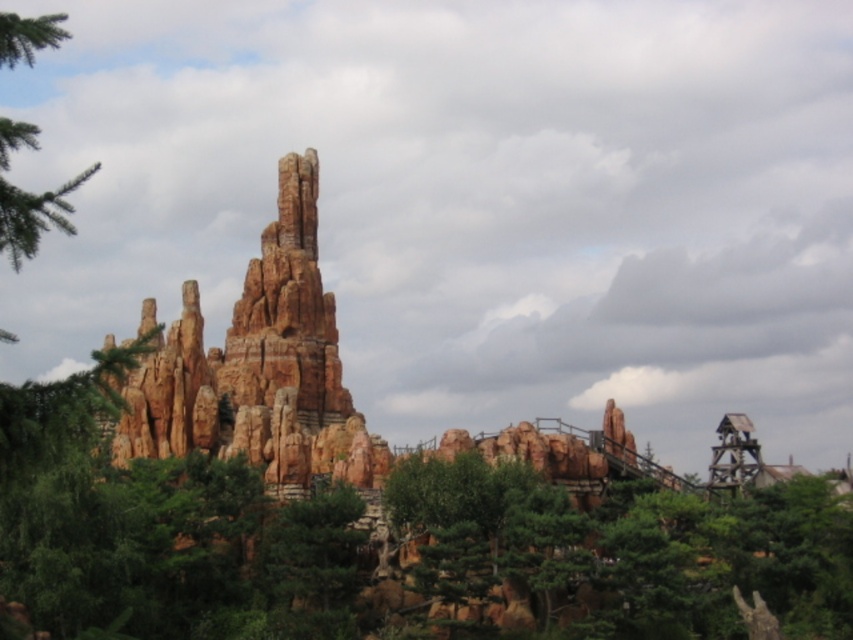
Question: Can you confirm if rustic stone rock formation at center is thinner than green textured tree at upper left?

Choices:
 (A) no
 (B) yes

Answer: (B)

Question: Which point is closer to the camera taking this photo?

Choices:
 (A) (236, 433)
 (B) (15, 212)

Answer: (B)

Question: Among these points, which one is nearest to the camera?

Choices:
 (A) (22, 129)
 (B) (286, 406)

Answer: (A)

Question: Does rustic stone rock formation at center appear under green textured tree at upper left?

Choices:
 (A) yes
 (B) no

Answer: (A)

Question: Which point is closer to the camera?

Choices:
 (A) rustic stone rock formation at center
 (B) green textured tree at upper left

Answer: (B)

Question: Does rustic stone rock formation at center come behind green textured tree at upper left?

Choices:
 (A) yes
 (B) no

Answer: (A)